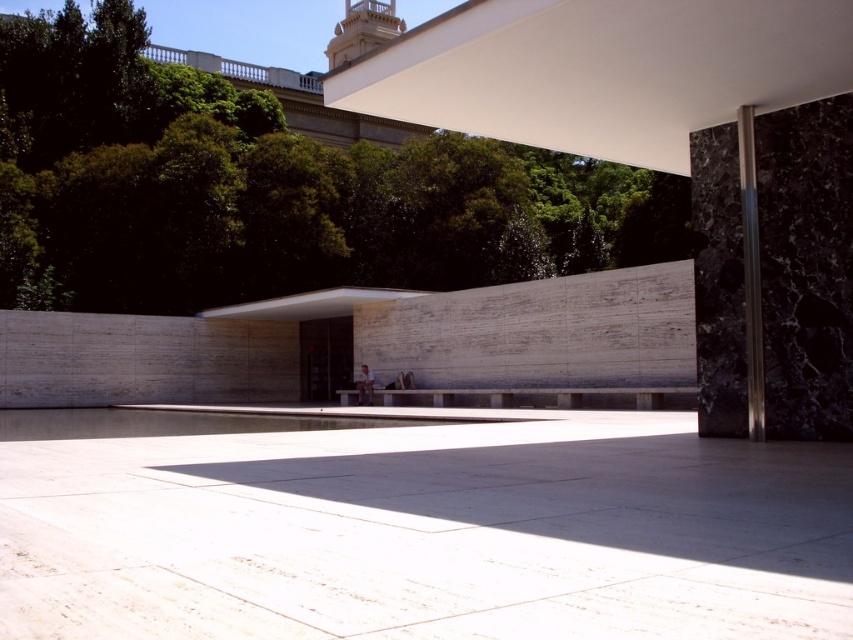
You are standing in the plaza and want to take a photo of the green leafy tree at upper center and the polished silver pole at right. Which object will appear bigger in your photo?

The green leafy tree at upper center will appear bigger in the photo because it has a larger size compared to the polished silver pole at right.

You are standing in the plaza and want to take a photo of the polished silver pole at right. Which side of the green leafy tree at upper center should you position yourself to capture the pole in the frame?

To capture the polished silver pole at right in the frame while positioning yourself relative to the green leafy tree at upper center, you should stand to the right side of the tree since the pole is located to the right of the tree.